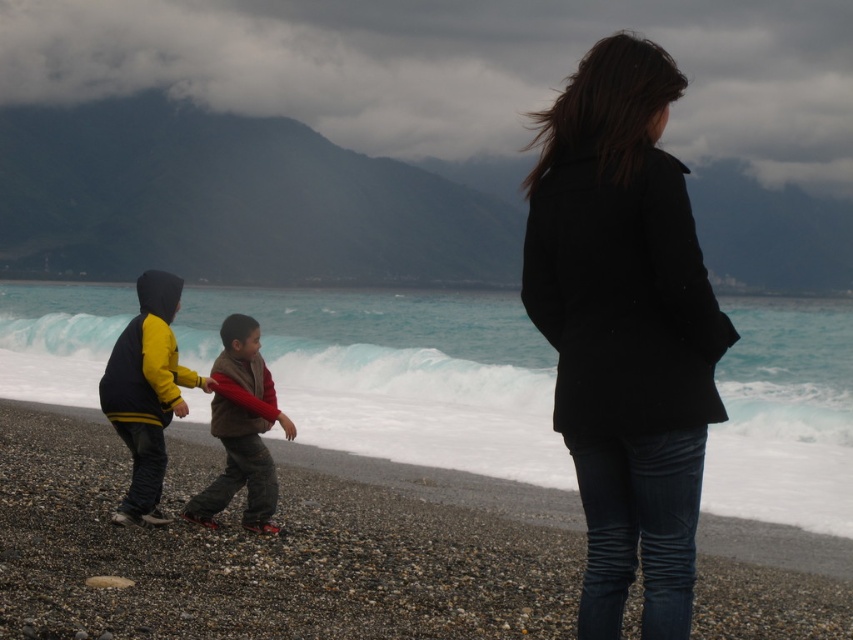
From the picture: Who is taller, smooth pebbles at center or yellow and black jacket at lower left?

Standing taller between the two is yellow and black jacket at lower left.

Where is `smooth pebbles at center`? Image resolution: width=853 pixels, height=640 pixels. smooth pebbles at center is located at coordinates (273, 552).

Locate an element on the screen. smooth pebbles at center is located at coordinates (273, 552).

Can you confirm if black matte coat at center is positioned to the left of brown fuzzy jacket at center?

Incorrect, black matte coat at center is not on the left side of brown fuzzy jacket at center.

Is point (683, 317) less distant than point (241, 396)?

Yes, point (683, 317) is closer to viewer.

Which is behind, point (718, 333) or point (254, 490)?

Point (254, 490)

You are a GUI agent. You are given a task and a screenshot of the screen. Output one action in this format:
    pyautogui.click(x=<x>, y=<y>)
    Task: Click on the black matte coat at center
    
    Given the screenshot: What is the action you would take?
    pyautogui.click(x=624, y=328)

Who is positioned more to the right, yellow and black jacket at lower left or brown fuzzy jacket at center?

brown fuzzy jacket at center is more to the right.

This screenshot has width=853, height=640. Identify the location of yellow and black jacket at lower left. point(146,394).

Does point (173, 400) come farther from viewer compared to point (224, 404)?

That is False.

You are a GUI agent. You are given a task and a screenshot of the screen. Output one action in this format:
    pyautogui.click(x=<x>, y=<y>)
    Task: Click on the yellow and black jacket at lower left
    The image size is (853, 640).
    Given the screenshot: What is the action you would take?
    pyautogui.click(x=146, y=394)